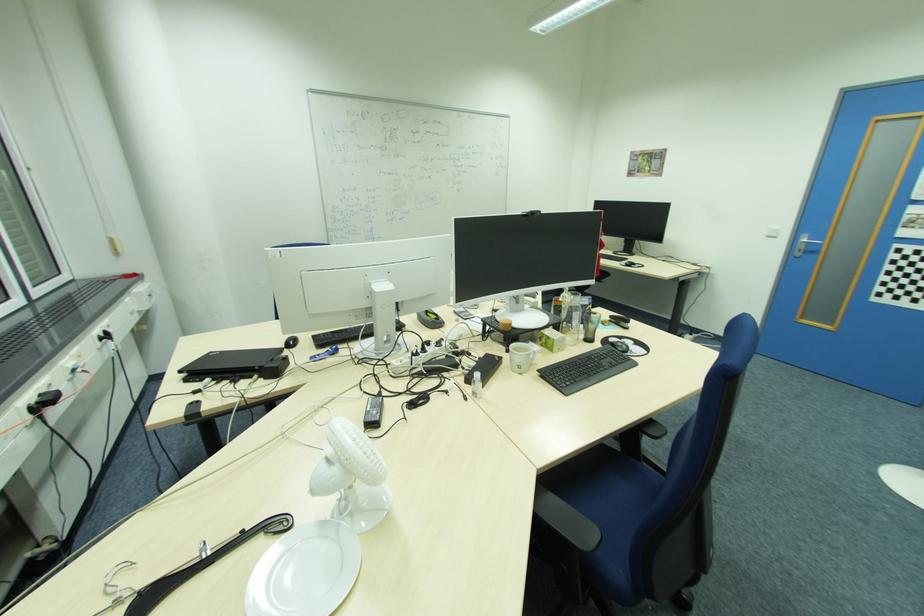
Which object does [552,339] point to?

This point indicates the small green box.